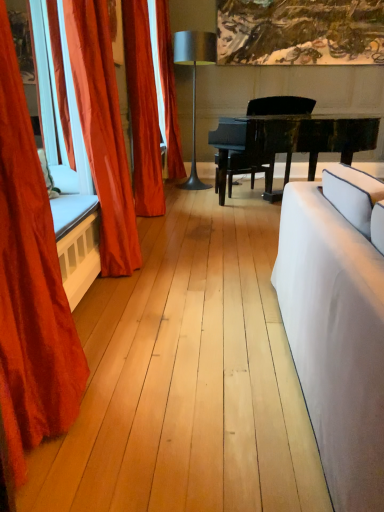
Question: Is black polished piano at center thinner than satin orange curtain at left, marked as the third curtain in a front-to-back arrangement?

Choices:
 (A) no
 (B) yes

Answer: (A)

Question: Is black polished piano at center wider than satin orange curtain at left, which is the second curtain from back to front?

Choices:
 (A) yes
 (B) no

Answer: (A)

Question: Does black polished piano at center touch satin orange curtain at left, which is the second curtain from back to front?

Choices:
 (A) no
 (B) yes

Answer: (A)

Question: Considering the relative sizes of black polished piano at center and satin orange curtain at left, which is the second curtain from back to front, in the image provided, is black polished piano at center smaller than satin orange curtain at left, which is the second curtain from back to front,?

Choices:
 (A) yes
 (B) no

Answer: (B)

Question: Can you confirm if black polished piano at center is taller than satin orange curtain at left, marked as the third curtain in a front-to-back arrangement?

Choices:
 (A) yes
 (B) no

Answer: (B)

Question: Considering the positions of white fabric couch at right and velvet red curtain at left, marked as the 1th curtain in a front-to-back arrangement, in the image, is white fabric couch at right wider or thinner than velvet red curtain at left, marked as the 1th curtain in a front-to-back arrangement,?

Choices:
 (A) wide
 (B) thin

Answer: (A)

Question: Considering the positions of white fabric couch at right and velvet red curtain at left, marked as the 1th curtain in a front-to-back arrangement, in the image, is white fabric couch at right bigger or smaller than velvet red curtain at left, marked as the 1th curtain in a front-to-back arrangement,?

Choices:
 (A) big
 (B) small

Answer: (A)

Question: From a real-world perspective, relative to velvet red curtain at left, arranged as the 4th curtain when viewed from the back, is white fabric couch at right vertically above or below?

Choices:
 (A) below
 (B) above

Answer: (A)

Question: In terms of height, does white fabric couch at right look taller or shorter compared to velvet red curtain at left, arranged as the 4th curtain when viewed from the back?

Choices:
 (A) tall
 (B) short

Answer: (B)

Question: Is point (139, 188) closer or farther from the camera than point (206, 41)?

Choices:
 (A) closer
 (B) farther

Answer: (A)

Question: Looking at their shapes, would you say satin orange curtain at left, which is the second curtain from back to front, is wider or thinner than metallic silver lamp at center?

Choices:
 (A) wide
 (B) thin

Answer: (B)

Question: Is satin orange curtain at left, marked as the third curtain in a front-to-back arrangement, inside or outside of metallic silver lamp at center?

Choices:
 (A) outside
 (B) inside

Answer: (A)

Question: Looking at the image, does satin orange curtain at left, marked as the third curtain in a front-to-back arrangement, seem bigger or smaller compared to metallic silver lamp at center?

Choices:
 (A) small
 (B) big

Answer: (A)

Question: In terms of width, does white fabric couch at right look wider or thinner when compared to metallic silver lamp at center?

Choices:
 (A) wide
 (B) thin

Answer: (A)

Question: Considering the positions of white fabric couch at right and metallic silver lamp at center in the image, is white fabric couch at right taller or shorter than metallic silver lamp at center?

Choices:
 (A) tall
 (B) short

Answer: (B)